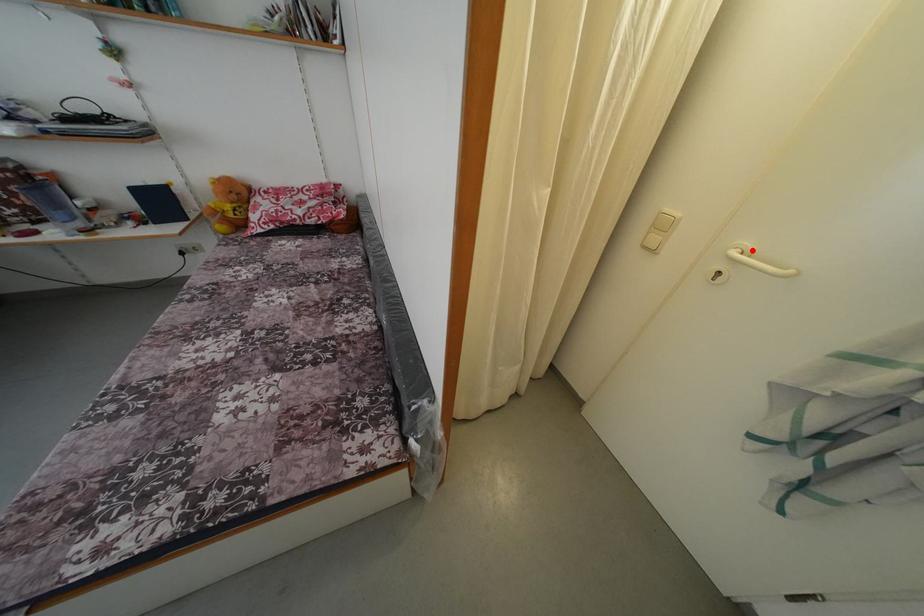
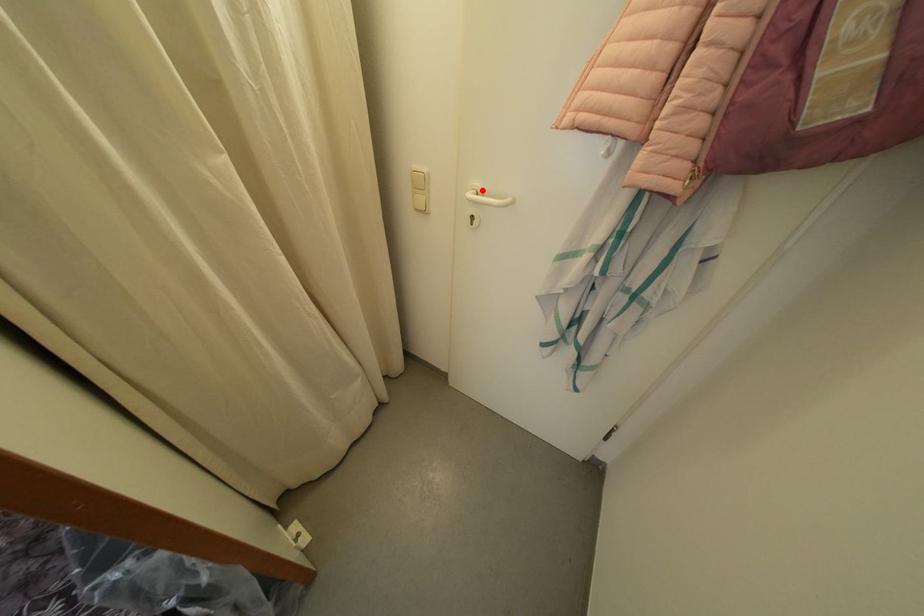
I am providing you with two images of the same scene from different viewpoints. A red point is marked on the first image and another point is marked on the second image. Is the red point in image1 aligned with the point shown in image2?

Yes